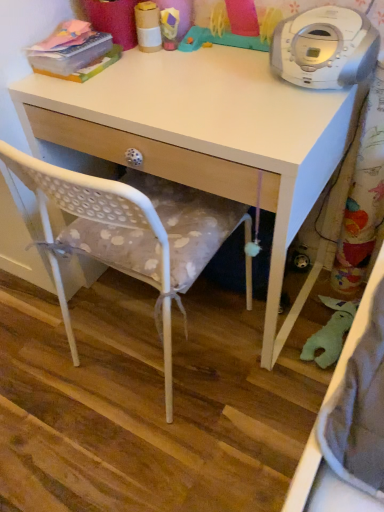
Locate an element on the screen. This screenshot has width=384, height=512. free spot to the left of white plastic cd player at upper right is located at coordinates (228, 92).